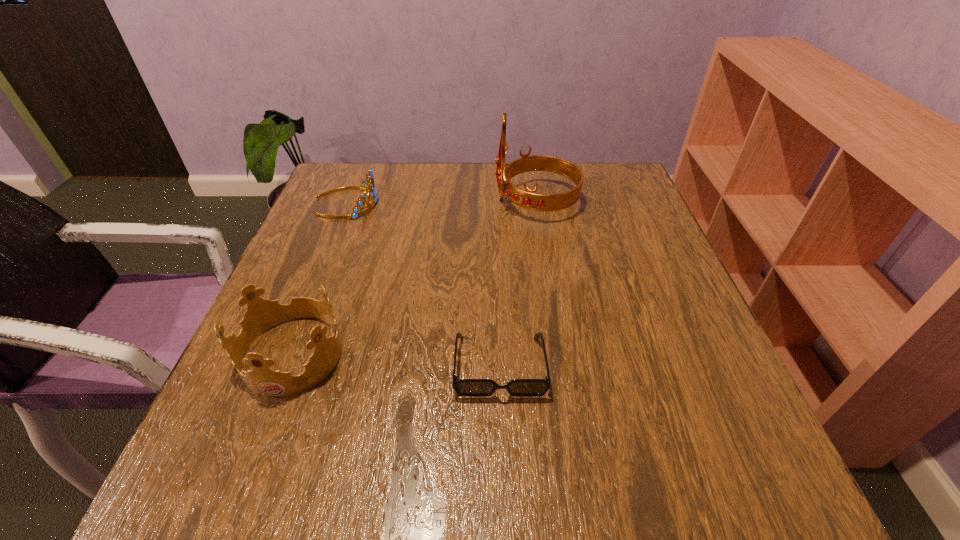
Find the location of a particular element. The height and width of the screenshot is (540, 960). object that stands as the third closest to the nearest tiara is located at coordinates (528, 199).

At what (x,y) coordinates should I click in order to perform the action: click on the closest tiara to the tallest tiara. Please return your answer as a coordinate pair (x, y). Looking at the image, I should click on (368, 185).

In order to click on the closest tiara to the second shortest object in this screenshot , I will do `click(528, 199)`.

Identify the location of vacant region that satisfies the following two spatial constraints: 1. on the front-facing side of the tallest tiara; 2. on the front-facing side of the nearest tiara. The width and height of the screenshot is (960, 540). tap(562, 354).

You are a GUI agent. You are given a task and a screenshot of the screen. Output one action in this format:
    pyautogui.click(x=<x>, y=<y>)
    Task: Click on the vacant space that satisfies the following two spatial constraints: 1. on the front-facing side of the tallest tiara; 2. on the front-facing side of the shortest object
    The width and height of the screenshot is (960, 540).
    Given the screenshot: What is the action you would take?
    coord(564,365)

Find the location of a particular element. Image resolution: width=960 pixels, height=540 pixels. vacant space that satisfies the following two spatial constraints: 1. on the front-facing side of the tallest object; 2. on the front-facing side of the nearest tiara is located at coordinates (562, 354).

At what (x,y) coordinates should I click in order to perform the action: click on vacant position in the image that satisfies the following two spatial constraints: 1. on the front-facing side of the tallest object; 2. on the front-facing side of the nearest tiara. Please return your answer as a coordinate pair (x, y). Image resolution: width=960 pixels, height=540 pixels. Looking at the image, I should click on (562, 354).

Where is `vacant space that satisfies the following two spatial constraints: 1. on the front-facing side of the tallest tiara; 2. on the front-facing side of the sunglasses`? vacant space that satisfies the following two spatial constraints: 1. on the front-facing side of the tallest tiara; 2. on the front-facing side of the sunglasses is located at coordinates (564, 365).

You are a GUI agent. You are given a task and a screenshot of the screen. Output one action in this format:
    pyautogui.click(x=<x>, y=<y>)
    Task: Click on the free region that satisfies the following two spatial constraints: 1. on the front-facing side of the tallest tiara; 2. on the front-facing side of the sunglasses
    This screenshot has height=540, width=960.
    Given the screenshot: What is the action you would take?
    pyautogui.click(x=564, y=365)